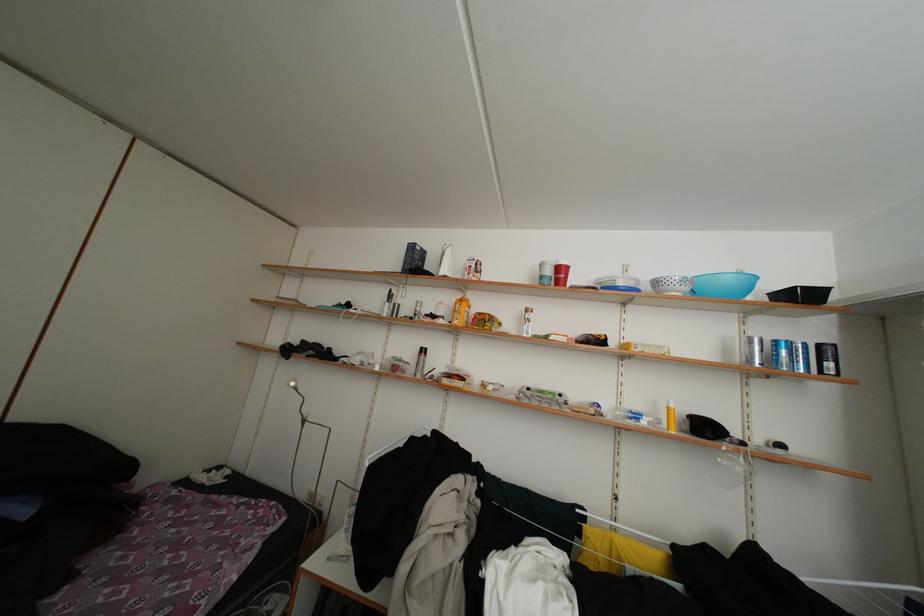
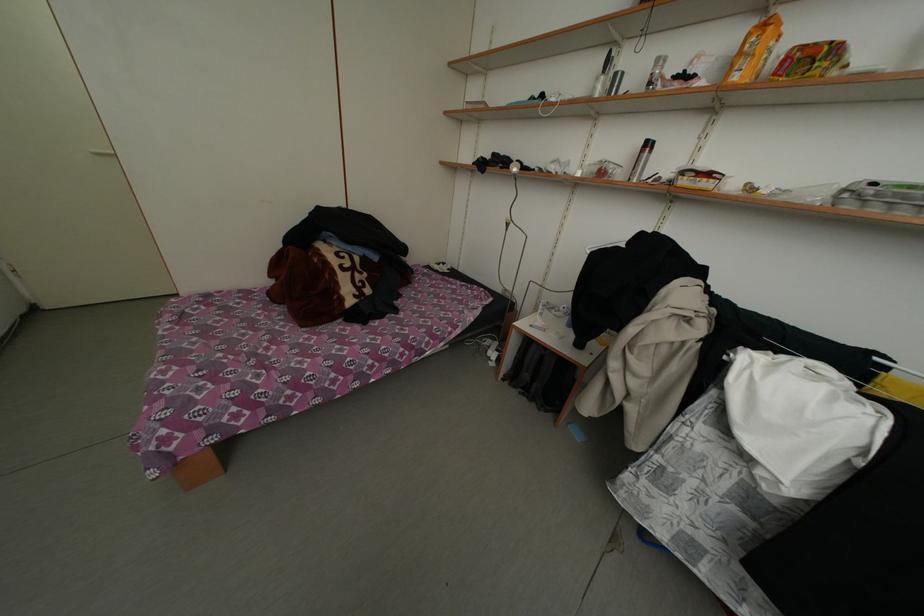
In the second image, find the point that corresponds to point (500, 323) in the first image.

(845, 55)